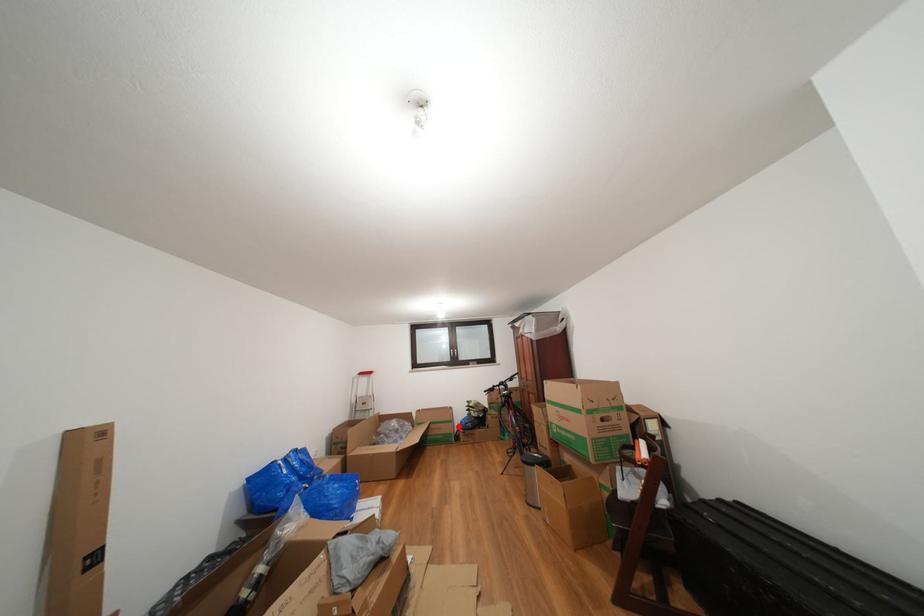
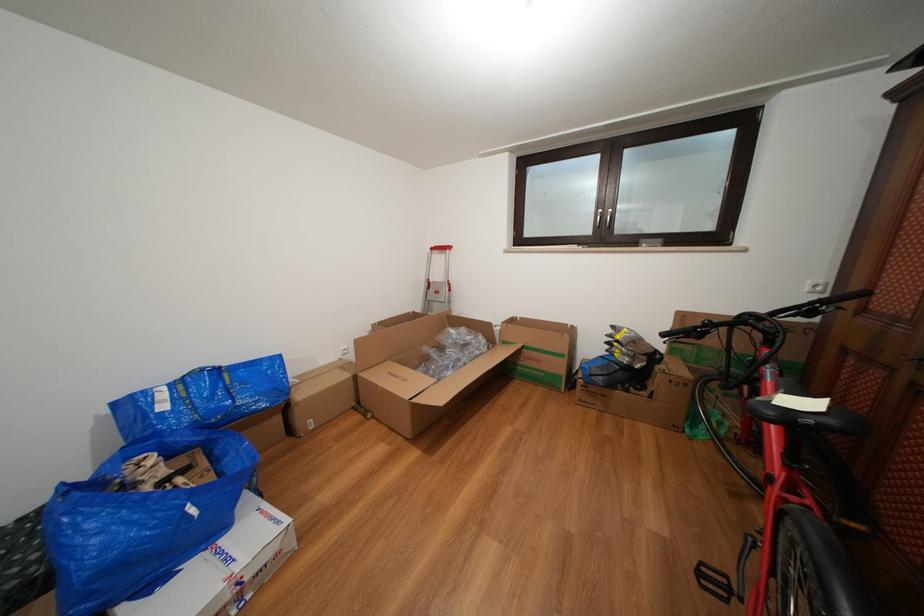
Question: I am providing you with two images of the same scene from different viewpoints. Image1 has a red point marked. In image2, the corresponding 3D location appears at what relative position? Reply with the corresponding letter.

Choices:
 (A) Closer
 (B) Farther

Answer: (A)